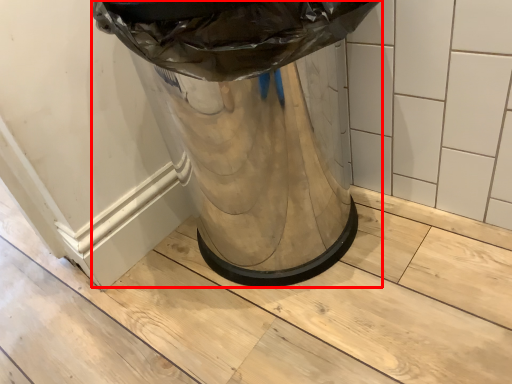
Question: From the image's perspective, what is the correct spatial relationship of waste container (annotated by the red box) in relation to tile?

Choices:
 (A) above
 (B) below

Answer: (B)